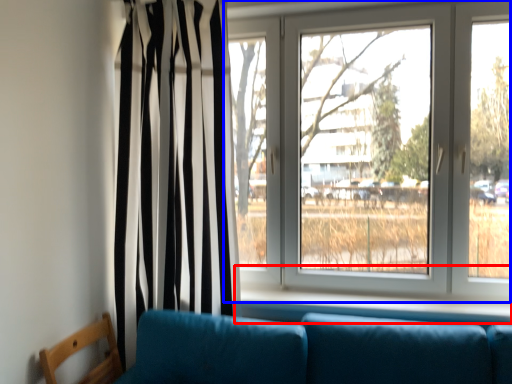
Question: Which object appears farthest to the camera in this image, window sill (highlighted by a red box) or window (highlighted by a blue box)?

Choices:
 (A) window sill
 (B) window

Answer: (B)